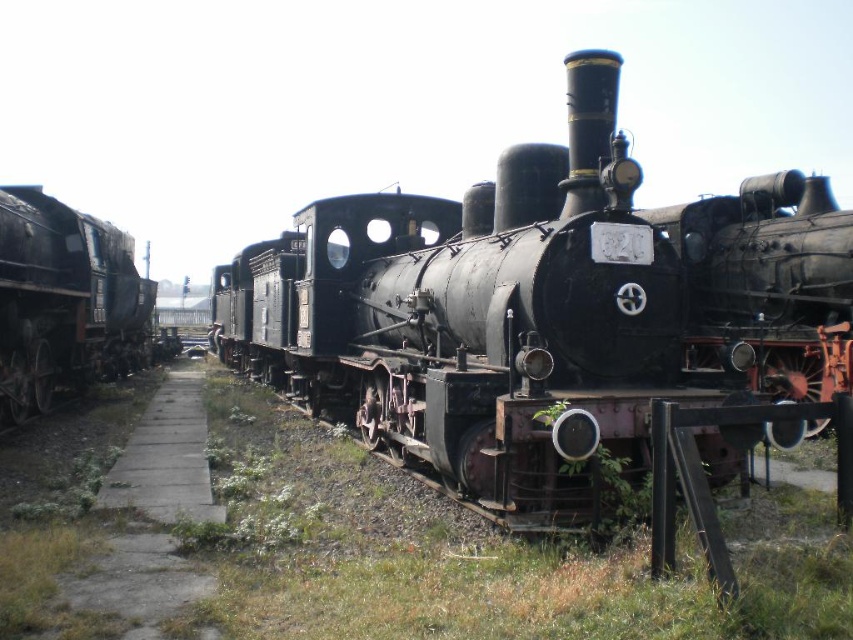
You are a photographer planning to capture the black matte locomotive at center and the rusty metal train at left in a single shot. Considering their heights, which one will appear larger in the photo?

The black matte locomotive at center is much taller than the rusty metal train at left, so it will appear larger in the photo.

Looking at this image, you are a railway engineer assessing the space needed to move the black matte locomotive at center and the rusty metal train at left. Which locomotive requires more space due to its size?

The black matte locomotive at center requires more space because its width is larger than the rusty metal train at left.

You are a photographer standing in the railway yard and want to take a closeup photo of the black matte locomotive at center. Based on your current position, can you get a clear closeup without moving closer than 15 feet?

The black matte locomotive at center is 15.04 feet away from camera, so you need to move slightly closer than 15 feet to get a clear closeup. Since you cannot move closer than 15 feet, you might not be able to capture a clear closeup from your current position.